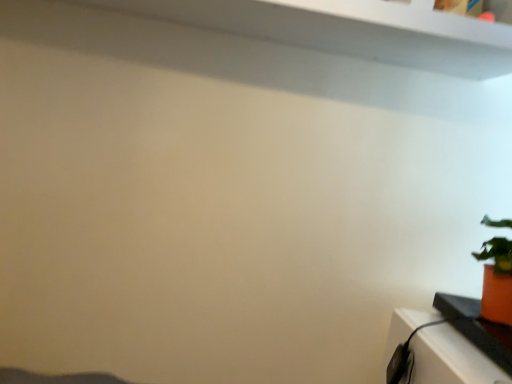
Question: From a real-world perspective, is orange matte pot at right physically located above or below orange matte pot at right?

Choices:
 (A) below
 (B) above

Answer: (B)

Question: Is orange matte pot at right taller or shorter than orange matte pot at right?

Choices:
 (A) tall
 (B) short

Answer: (A)

Question: Looking at their shapes, would you say orange matte pot at right is wider or thinner than orange matte pot at right?

Choices:
 (A) thin
 (B) wide

Answer: (A)

Question: Considering their positions, is orange matte pot at right located in front of or behind orange matte pot at right?

Choices:
 (A) behind
 (B) front

Answer: (B)

Question: Considering the positions of orange matte pot at right and orange matte pot at right in the image, is orange matte pot at right wider or thinner than orange matte pot at right?

Choices:
 (A) wide
 (B) thin

Answer: (A)

Question: Considering the relative positions of orange matte pot at right and orange matte pot at right in the image provided, is orange matte pot at right to the left or to the right of orange matte pot at right?

Choices:
 (A) right
 (B) left

Answer: (B)

Question: From the image's perspective, is orange matte pot at right above or below orange matte pot at right?

Choices:
 (A) above
 (B) below

Answer: (B)